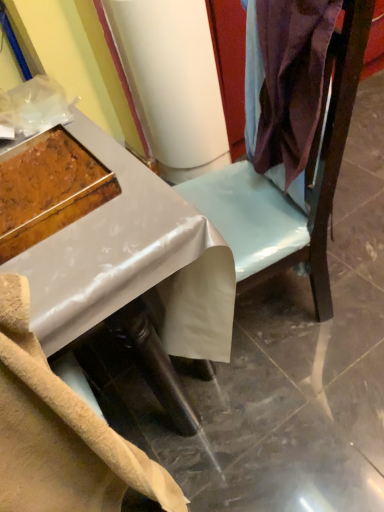
At what (x,y) coordinates should I click in order to perform the action: click on wooden tray at left. Please return your answer as a coordinate pair (x, y). Looking at the image, I should click on (44, 177).

Measure the distance between satin purple fabric at upper right and camera.

28.27 inches.

Where is `wooden tray at left`? wooden tray at left is located at coordinates (44, 177).

In the image, is white glossy desk at center positioned in front of or behind wooden tray at left?

Clearly, white glossy desk at center is in front of wooden tray at left.

From the image's perspective, is white glossy desk at center located above or below wooden tray at left?

white glossy desk at center is below wooden tray at left.

Is point (156, 297) closer or farther from the camera than point (59, 180)?

Point (156, 297) appears to be farther away from the viewer than point (59, 180).

Is white glossy desk at center turned away from wooden tray at left?

No, white glossy desk at center is not facing the opposite direction of wooden tray at left.

From the picture: From the image's perspective, is wooden tray at left below white glossy desk at center?

No.

Considering the relative sizes of wooden tray at left and white glossy desk at center in the image provided, is wooden tray at left smaller than white glossy desk at center?

Yes.

Can you tell me how much wooden tray at left and white glossy desk at center differ in facing direction?

0.489 degrees separate the facing orientations of wooden tray at left and white glossy desk at center.

Can you confirm if wooden tray at left is taller than white glossy desk at center?

No, wooden tray at left is not taller than white glossy desk at center.

From a real-world perspective, who is located higher, satin purple fabric at upper right or wooden tray at left?

wooden tray at left is physically above.

Considering the sizes of objects satin purple fabric at upper right and wooden tray at left in the image provided, who is smaller, satin purple fabric at upper right or wooden tray at left?

With smaller size is wooden tray at left.

Consider the image. From the image's perspective, which is below, satin purple fabric at upper right or wooden tray at left?

wooden tray at left is shown below in the image.

Considering the positions of objects satin purple fabric at upper right and wooden tray at left in the image provided, who is more to the left, satin purple fabric at upper right or wooden tray at left?

wooden tray at left is more to the left.

In terms of size, does wooden tray at left appear bigger or smaller than satin purple fabric at upper right?

wooden tray at left is smaller than satin purple fabric at upper right.

In order to click on furniture below the wooden tray at left (from a real-world perspective) in this screenshot , I will do `click(281, 193)`.

From the image's perspective, which one is positioned higher, wooden tray at left or satin purple fabric at upper right?

satin purple fabric at upper right is shown above in the image.

Is white glossy desk at center touching satin purple fabric at upper right?

They are not placed beside each other.

Is white glossy desk at center aimed at satin purple fabric at upper right?

No, white glossy desk at center does not turn towards satin purple fabric at upper right.

Considering the sizes of objects white glossy desk at center and satin purple fabric at upper right in the image provided, who is taller, white glossy desk at center or satin purple fabric at upper right?

Standing taller between the two is white glossy desk at center.

This screenshot has height=512, width=384. In order to click on desk that is below the satin purple fabric at upper right (from the image's perspective) in this screenshot , I will do point(125,267).

Are satin purple fabric at upper right and white glossy desk at center making contact?

No, satin purple fabric at upper right is not beside white glossy desk at center.

Considering the sizes of satin purple fabric at upper right and white glossy desk at center in the image, is satin purple fabric at upper right bigger or smaller than white glossy desk at center?

Clearly, satin purple fabric at upper right is smaller in size than white glossy desk at center.

Which is more distant, (x=254, y=259) or (x=210, y=336)?

The point (x=254, y=259) is behind.

From a real-world perspective, does satin purple fabric at upper right sit lower than white glossy desk at center?

No, from a real-world perspective, satin purple fabric at upper right is not beneath white glossy desk at center.

The image size is (384, 512). In order to click on desk lying below the wooden tray at left (from the image's perspective) in this screenshot , I will do `click(125, 267)`.

In order to click on desk lying in front of the wooden tray at left in this screenshot , I will do click(125, 267).

Looking at the image, which one is located further to wooden tray at left, white glossy desk at center or satin purple fabric at upper right?

satin purple fabric at upper right is positioned further to the anchor wooden tray at left.

Which object lies nearer to the anchor point white glossy desk at center, wooden tray at left or satin purple fabric at upper right?

The object closer to white glossy desk at center is wooden tray at left.

Estimate the real-world distances between objects in this image. Which object is closer to satin purple fabric at upper right, white glossy desk at center or wooden tray at left?

white glossy desk at center is positioned closer to the anchor satin purple fabric at upper right.

From the image, which object appears to be farther from white glossy desk at center, satin purple fabric at upper right or wooden tray at left?

satin purple fabric at upper right is positioned further to the anchor white glossy desk at center.

Based on their spatial positions, is wooden tray at left or white glossy desk at center further from satin purple fabric at upper right?

The object further to satin purple fabric at upper right is wooden tray at left.

Looking at this image, looking at the image, which one is located closer to wooden tray at left, satin purple fabric at upper right or white glossy desk at center?

Among the two, white glossy desk at center is located nearer to wooden tray at left.

The height and width of the screenshot is (512, 384). I want to click on desk between wooden tray at left and satin purple fabric at upper right from left to right, so click(125, 267).